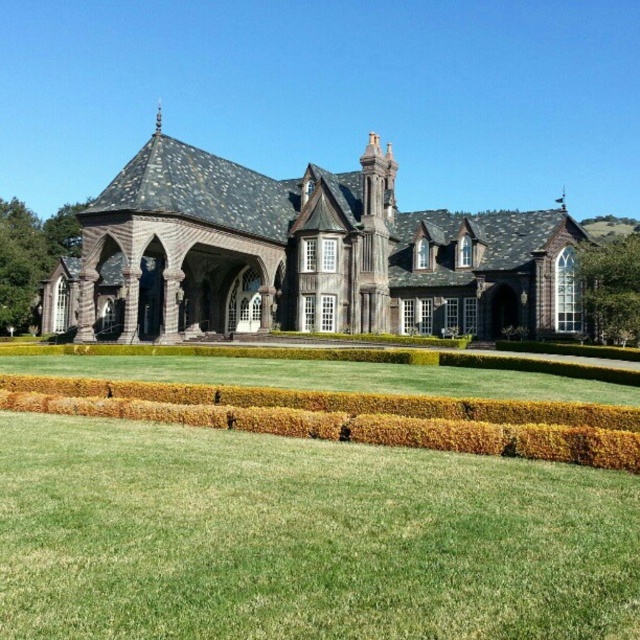
Can you confirm if green grass at center is positioned to the left of wooden church at center?

Yes, green grass at center is to the left of wooden church at center.

Between point (102, 525) and point (285, 275), which one is positioned in front?

Positioned in front is point (102, 525).

At what (x,y) coordinates should I click in order to perform the action: click on green grass at center. Please return your answer as a coordinate pair (x, y). The height and width of the screenshot is (640, 640). Looking at the image, I should click on (301, 538).

Looking at this image, who is positioned more to the right, wooden church at center or green textured hedge at lower center?

wooden church at center is more to the right.

Based on the photo, which is above, wooden church at center or green textured hedge at lower center?

wooden church at center

You are a GUI agent. You are given a task and a screenshot of the screen. Output one action in this format:
    pyautogui.click(x=<x>, y=<y>)
    Task: Click on the wooden church at center
    The height and width of the screenshot is (640, 640).
    Given the screenshot: What is the action you would take?
    pyautogui.click(x=301, y=257)

This screenshot has width=640, height=640. Identify the location of wooden church at center. (301, 257).

Can you confirm if green grass at center is positioned below green textured hedge at lower center?

Correct, green grass at center is located below green textured hedge at lower center.

In the scene shown: Between green grass at center and green textured hedge at lower center, which one is positioned lower?

green grass at center

Which is behind, point (122, 481) or point (160, 420)?

The point (160, 420) is more distant.

Locate an element on the screen. green grass at center is located at coordinates pyautogui.click(x=301, y=538).